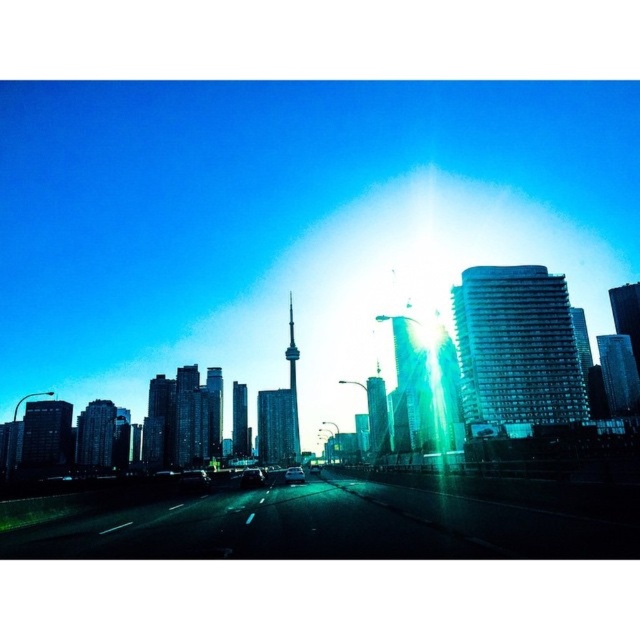
Question: Is green glossy highway at center bigger than shiny black car at center?

Choices:
 (A) yes
 (B) no

Answer: (B)

Question: Which point is closer to the camera taking this photo?

Choices:
 (A) (204, 476)
 (B) (252, 468)
 (C) (282, 484)
 (D) (300, 476)

Answer: (A)

Question: Is green glossy highway at center positioned before shiny black car at center?

Choices:
 (A) no
 (B) yes

Answer: (B)

Question: Considering the relative positions of green glossy highway at center and shiny black car at center in the image provided, where is green glossy highway at center located with respect to shiny black car at center?

Choices:
 (A) below
 (B) above

Answer: (B)

Question: Which is farther from the shiny black sedan at center?

Choices:
 (A) metallic silver car at center
 (B) shiny black car at center
 (C) green glossy highway at center

Answer: (A)

Question: Based on their relative distances, which object is farther from the metallic silver car at center?

Choices:
 (A) shiny black sedan at center
 (B) shiny black car at center
 (C) green glossy highway at center

Answer: (C)